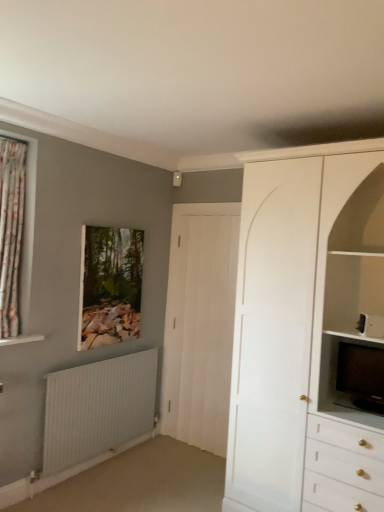
The height and width of the screenshot is (512, 384). Describe the element at coordinates (27, 225) in the screenshot. I see `floral fabric curtain at left` at that location.

What is the approximate width of wooden frame at upper center?

It is 2.71 inches.

In order to face white matte cabinet at upper right, should I rotate leftwards or rightwards?

Turn right by 16.986 degrees to look at white matte cabinet at upper right.

I want to click on white ribbed radiator at lower left, so click(x=98, y=408).

Is wooden frame at upper center not near floral fabric curtain at left?

No, wooden frame at upper center is not far away from floral fabric curtain at left.

Based on the photo, from the image's perspective, would you say wooden frame at upper center is positioned over floral fabric curtain at left?

No, from the image's perspective, wooden frame at upper center is not on top of floral fabric curtain at left.

Can you confirm if wooden frame at upper center is thinner than floral fabric curtain at left?

Yes, wooden frame at upper center is thinner than floral fabric curtain at left.

From a real-world perspective, who is located higher, wooden frame at upper center or white ribbed radiator at lower left?

wooden frame at upper center is physically above.

Is wooden frame at upper center shorter than white ribbed radiator at lower left?

No.

Is floral fabric curtain at left not close to white matte cabinet at upper right?

Absolutely, floral fabric curtain at left is distant from white matte cabinet at upper right.

Does floral fabric curtain at left have a smaller size compared to white matte cabinet at upper right?

Indeed, floral fabric curtain at left has a smaller size compared to white matte cabinet at upper right.

The height and width of the screenshot is (512, 384). Find the location of `cabinetry lying below the floral fabric curtain at left (from the image's perspective)`. cabinetry lying below the floral fabric curtain at left (from the image's perspective) is located at coordinates (307, 336).

Based on the photo, from the image's perspective, which one is positioned lower, floral fabric curtain at left or white matte cabinet at upper right?

white matte cabinet at upper right appears lower in the image.

Is white wood door at center at the right side of white matte cabinet at upper right?

No.

Which is behind, white wood door at center or white matte cabinet at upper right?

white wood door at center is behind.

Is white wood door at center spatially inside white matte cabinet at upper right, or outside of it?

white wood door at center is not enclosed by white matte cabinet at upper right.

In terms of width, does white wood door at center look wider or thinner when compared to white matte cabinet at upper right?

In the image, white wood door at center appears to be more narrow than white matte cabinet at upper right.

In the scene shown: How different are the orientations of black glossy television at right and white ribbed radiator at lower left in degrees?

The angle between the facing direction of black glossy television at right and the facing direction of white ribbed radiator at lower left is 90 degrees.

From a real-world perspective, is black glossy television at right below white ribbed radiator at lower left?

Incorrect, from a real-world perspective, black glossy television at right is higher than white ribbed radiator at lower left.

Considering the points (379, 370) and (96, 416), which point is behind, point (379, 370) or point (96, 416)?

The point (96, 416) is farther.

From the image's perspective, would you say black glossy television at right is shown under white ribbed radiator at lower left?

No, from the image's perspective, black glossy television at right is not beneath white ribbed radiator at lower left.

Does point (92, 432) come in front of point (186, 391)?

Yes, it is in front of point (186, 391).

From the picture: From a real-world perspective, is white ribbed radiator at lower left positioned above or below white wood door at center?

white ribbed radiator at lower left is situated lower than white wood door at center in the real world.

Between white ribbed radiator at lower left and white wood door at center, which one has larger width?

white ribbed radiator at lower left is wider.

From the picture: Measure the distance from white ribbed radiator at lower left to white wood door at center.

white ribbed radiator at lower left is 28.58 inches away from white wood door at center.

Considering the relative sizes of floral fabric curtain at left and black glossy television at right in the image provided, is floral fabric curtain at left taller than black glossy television at right?

Yes, floral fabric curtain at left is taller than black glossy television at right.

How distant is floral fabric curtain at left from black glossy television at right?

floral fabric curtain at left and black glossy television at right are 6.83 feet apart.

Considering the points (27, 208) and (371, 364), which point is in front, point (27, 208) or point (371, 364)?

The point (371, 364) is closer.

Is floral fabric curtain at left smaller than black glossy television at right?

No.

The image size is (384, 512). What are the coordinates of `window that appears in front of the wooden frame at upper center` in the screenshot? It's located at (27, 225).

Locate an element on the screen. picture frame that is above the white ribbed radiator at lower left (from the image's perspective) is located at coordinates (110, 286).

Looking at the image, which one is located further to white matte cabinet at upper right, white wood door at center or white ribbed radiator at lower left?

The object further to white matte cabinet at upper right is white ribbed radiator at lower left.

Which object lies nearer to the anchor point white matte cabinet at upper right, floral fabric curtain at left or black glossy television at right?

black glossy television at right.

From the image, which object appears to be nearer to wooden frame at upper center, white wood door at center or white matte cabinet at upper right?

Based on the image, white wood door at center appears to be nearer to wooden frame at upper center.

Considering their positions, is white matte cabinet at upper right positioned further to white wood door at center than floral fabric curtain at left?

The object further to white wood door at center is floral fabric curtain at left.

In the scene shown: Looking at the image, which one is located closer to white ribbed radiator at lower left, floral fabric curtain at left or white matte cabinet at upper right?

Based on the image, floral fabric curtain at left appears to be nearer to white ribbed radiator at lower left.

Based on their spatial positions, is white ribbed radiator at lower left or white matte cabinet at upper right closer to white wood door at center?

white ribbed radiator at lower left.

Considering their positions, is wooden frame at upper center positioned further to white ribbed radiator at lower left than floral fabric curtain at left?

The object further to white ribbed radiator at lower left is floral fabric curtain at left.

Looking at the image, which one is located further to white wood door at center, black glossy television at right or wooden frame at upper center?

black glossy television at right is further to white wood door at center.

Where is `door between white ribbed radiator at lower left and black glossy television at right`? door between white ribbed radiator at lower left and black glossy television at right is located at coordinates (200, 324).

Identify the location of radiator between floral fabric curtain at left and black glossy television at right from left to right. The height and width of the screenshot is (512, 384). (98, 408).

Locate an element on the screen. radiator between floral fabric curtain at left and white wood door at center from left to right is located at coordinates (98, 408).

Locate an element on the screen. The width and height of the screenshot is (384, 512). door between floral fabric curtain at left and black glossy television at right in the horizontal direction is located at coordinates (200, 324).